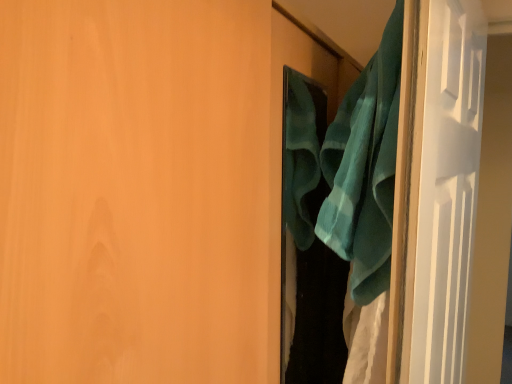
Question: Can you confirm if teal fabric at right is taller than teal fabric at right?

Choices:
 (A) yes
 (B) no

Answer: (A)

Question: Is teal fabric at right closer to camera compared to teal fabric at right?

Choices:
 (A) no
 (B) yes

Answer: (A)

Question: Is teal fabric at right looking in the opposite direction of teal fabric at right?

Choices:
 (A) yes
 (B) no

Answer: (A)

Question: Is teal fabric at right thinner than teal fabric at right?

Choices:
 (A) no
 (B) yes

Answer: (B)

Question: From the image's perspective, is teal fabric at right beneath teal fabric at right?

Choices:
 (A) no
 (B) yes

Answer: (A)

Question: Is teal fabric at right inside the boundaries of teal soft towel at right, or outside?

Choices:
 (A) inside
 (B) outside

Answer: (B)

Question: Is teal fabric at right bigger or smaller than teal soft towel at right?

Choices:
 (A) big
 (B) small

Answer: (A)

Question: Considering the positions of teal fabric at right and teal soft towel at right in the image, is teal fabric at right wider or thinner than teal soft towel at right?

Choices:
 (A) thin
 (B) wide

Answer: (B)

Question: From a real-world perspective, is teal fabric at right above or below teal soft towel at right?

Choices:
 (A) above
 (B) below

Answer: (B)

Question: Choose the correct answer: Is teal fabric at right inside teal soft towel at right or outside it?

Choices:
 (A) outside
 (B) inside

Answer: (A)

Question: In terms of width, does teal fabric at right look wider or thinner when compared to teal soft towel at right?

Choices:
 (A) thin
 (B) wide

Answer: (B)

Question: Is teal fabric at right taller or shorter than teal soft towel at right?

Choices:
 (A) tall
 (B) short

Answer: (A)

Question: Is point (452, 279) closer or farther from the camera than point (381, 195)?

Choices:
 (A) farther
 (B) closer

Answer: (A)

Question: Considering the positions of teal fabric at right and teal fabric at right in the image, is teal fabric at right wider or thinner than teal fabric at right?

Choices:
 (A) wide
 (B) thin

Answer: (B)

Question: Based on their positions, is teal fabric at right located to the left or right of teal fabric at right?

Choices:
 (A) right
 (B) left

Answer: (A)